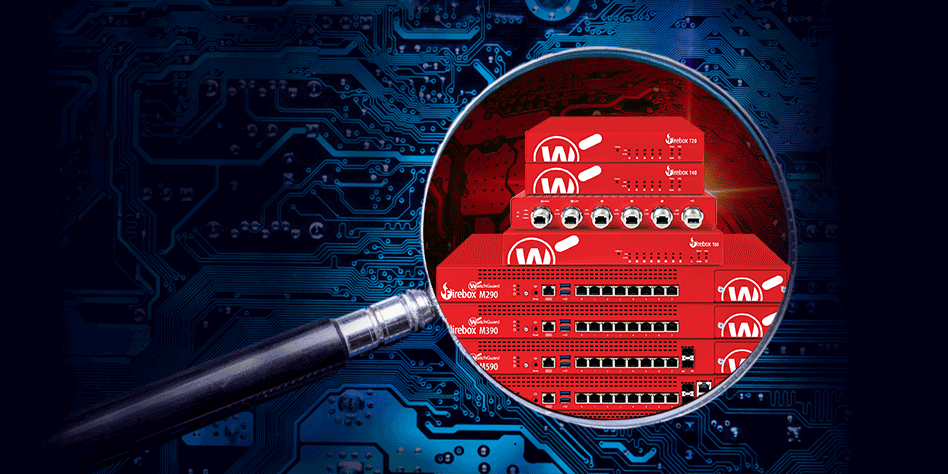
I want to click on ventilation grate, so click(x=593, y=273), click(x=597, y=306), click(x=593, y=347), click(x=596, y=416).